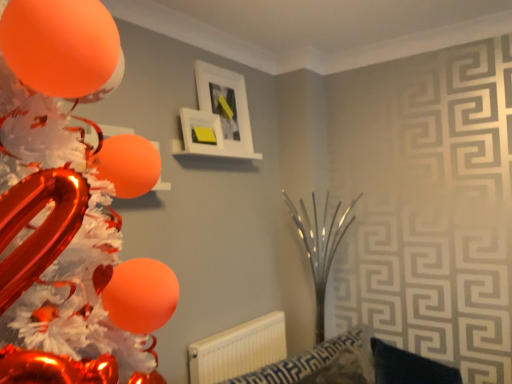
You are a GUI agent. You are given a task and a screenshot of the screen. Output one action in this format:
    pyautogui.click(x=<x>, y=<y>)
    Task: Click on the free space above white matte picture frame at upper center, which is counted as the first picture frame, starting from the back (from a real-world perspective)
    
    Given the screenshot: What is the action you would take?
    pyautogui.click(x=217, y=66)